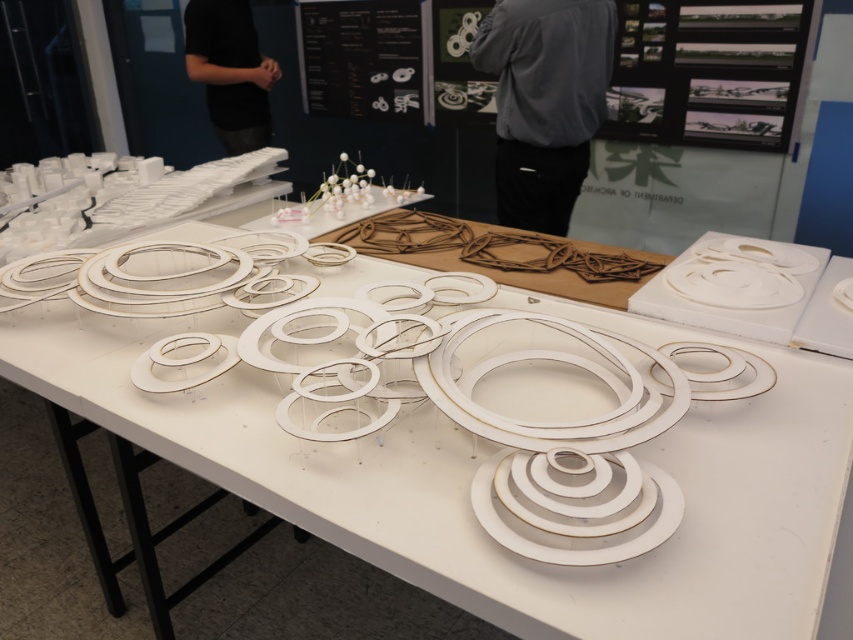
Can you confirm if white cardboard circles at center is wider than black shirt at upper left?

Indeed, white cardboard circles at center has a greater width compared to black shirt at upper left.

Does white cardboard circles at center come in front of black shirt at upper left?

Yes, it is.

Which is behind, point (601, 436) or point (227, 90)?

The point (227, 90) is behind.

Where is `white cardboard circles at center`? This screenshot has height=640, width=853. white cardboard circles at center is located at coordinates (465, 429).

Is white cardboard circles at center further to the viewer compared to white matte plate at center?

That is False.

Which is in front, point (798, 595) or point (161, 344)?

Point (798, 595) is more forward.

Is point (369, 317) less distant than point (158, 362)?

No.

Image resolution: width=853 pixels, height=640 pixels. Identify the location of white cardboard circles at center. (465, 429).

Who is positioned more to the left, gray fabric pants at center or white matte plate at center?

From the viewer's perspective, white matte plate at center appears more on the left side.

Can you confirm if gray fabric pants at center is wider than white matte plate at center?

Yes.

Who is more forward, (x=576, y=20) or (x=178, y=358)?

Point (x=178, y=358) is in front.

This screenshot has width=853, height=640. Find the location of `gray fabric pants at center`. gray fabric pants at center is located at coordinates (544, 100).